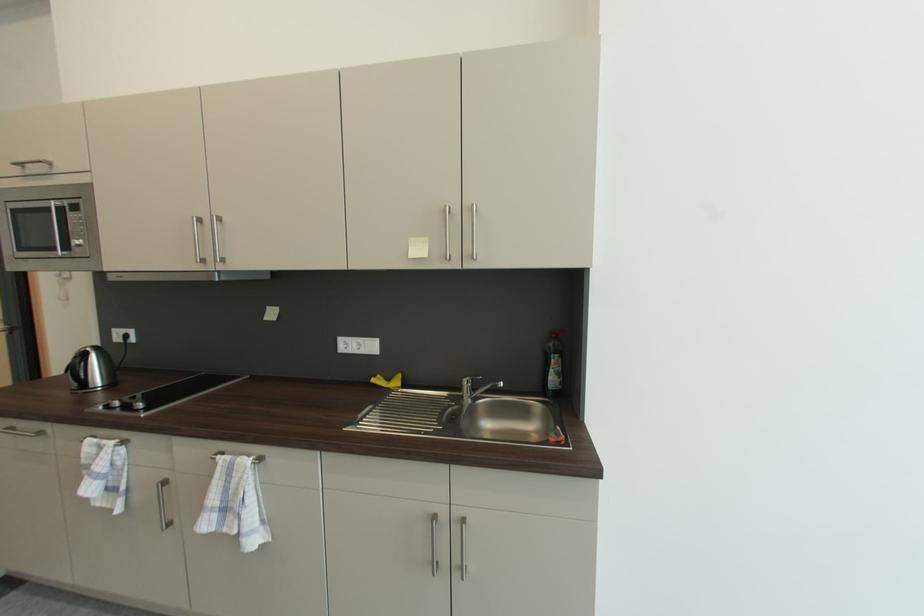
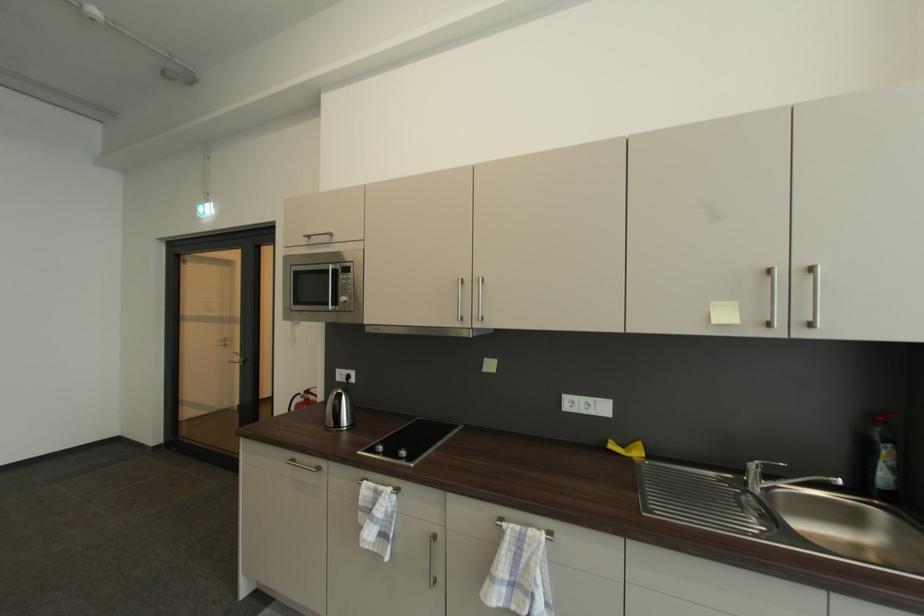
Locate, in the second image, the point that corresponds to the point at 256,458 in the first image.

(545, 531)